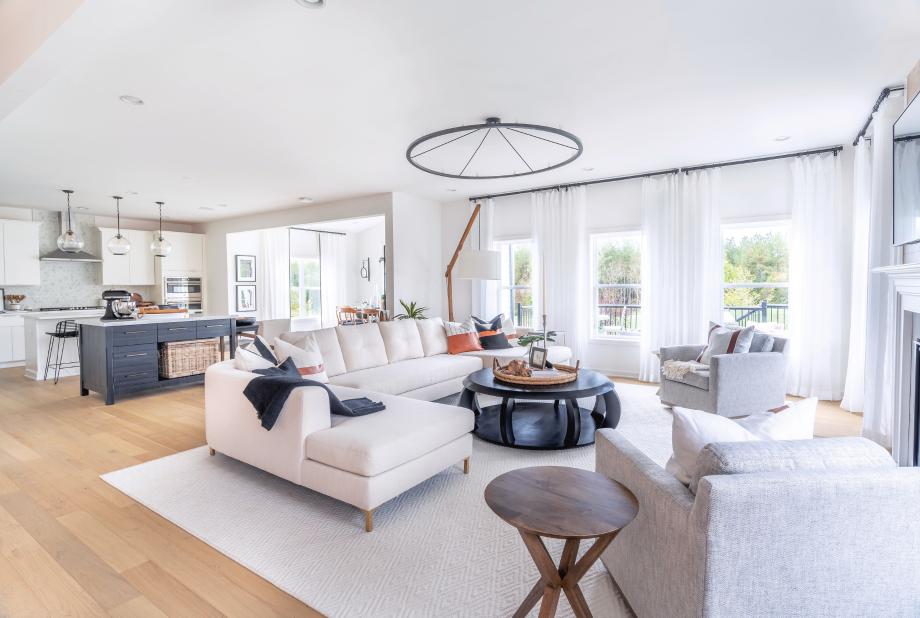
You are a GUI agent. You are given a task and a screenshot of the screen. Output one action in this format:
    pyautogui.click(x=<x>, y=<y>)
    Task: Click on the basket
    The width and height of the screenshot is (920, 618).
    Given the screenshot: What is the action you would take?
    pyautogui.click(x=180, y=358)